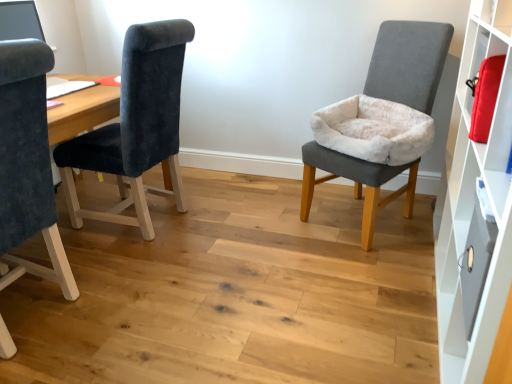
Question: Can you confirm if metallic gray drawer at right is smaller than velvet gray chair at right, acting as the third chair starting from the left?

Choices:
 (A) yes
 (B) no

Answer: (A)

Question: Considering the relative sizes of metallic gray drawer at right and velvet gray chair at right, acting as the third chair starting from the left, in the image provided, is metallic gray drawer at right taller than velvet gray chair at right, acting as the third chair starting from the left,?

Choices:
 (A) no
 (B) yes

Answer: (A)

Question: Is metallic gray drawer at right oriented away from velvet gray chair at right, acting as the third chair starting from the left?

Choices:
 (A) no
 (B) yes

Answer: (A)

Question: Considering the relative positions of metallic gray drawer at right and velvet gray chair at right, the first chair viewed from the right, in the image provided, is metallic gray drawer at right to the right of velvet gray chair at right, the first chair viewed from the right, from the viewer's perspective?

Choices:
 (A) yes
 (B) no

Answer: (A)

Question: Could you tell me if metallic gray drawer at right is turned towards velvet gray chair at right, acting as the third chair starting from the left?

Choices:
 (A) yes
 (B) no

Answer: (B)

Question: From the image's perspective, is metallic gray drawer at right below velvet gray chair at right, acting as the third chair starting from the left?

Choices:
 (A) no
 (B) yes

Answer: (B)

Question: Is white matte cabinet at right shorter than velvet dark blue chair at left, which is the 1th chair from left to right?

Choices:
 (A) no
 (B) yes

Answer: (A)

Question: Is white matte cabinet at right to the right of velvet dark blue chair at left, the third chair viewed from the right, from the viewer's perspective?

Choices:
 (A) yes
 (B) no

Answer: (A)

Question: Is white matte cabinet at right wider than velvet dark blue chair at left, the third chair viewed from the right?

Choices:
 (A) yes
 (B) no

Answer: (B)

Question: Is white matte cabinet at right facing towards velvet dark blue chair at left, which is the 1th chair from left to right?

Choices:
 (A) yes
 (B) no

Answer: (A)

Question: From a real-world perspective, does white matte cabinet at right stand above velvet dark blue chair at left, which is the 1th chair from left to right?

Choices:
 (A) yes
 (B) no

Answer: (A)

Question: Is white matte cabinet at right closer to the viewer compared to velvet dark blue chair at left, the third chair viewed from the right?

Choices:
 (A) yes
 (B) no

Answer: (A)

Question: From the image's perspective, is metallic gray drawer at right located above velvet dark blue chair at left, the second chair positioned from the left?

Choices:
 (A) yes
 (B) no

Answer: (B)